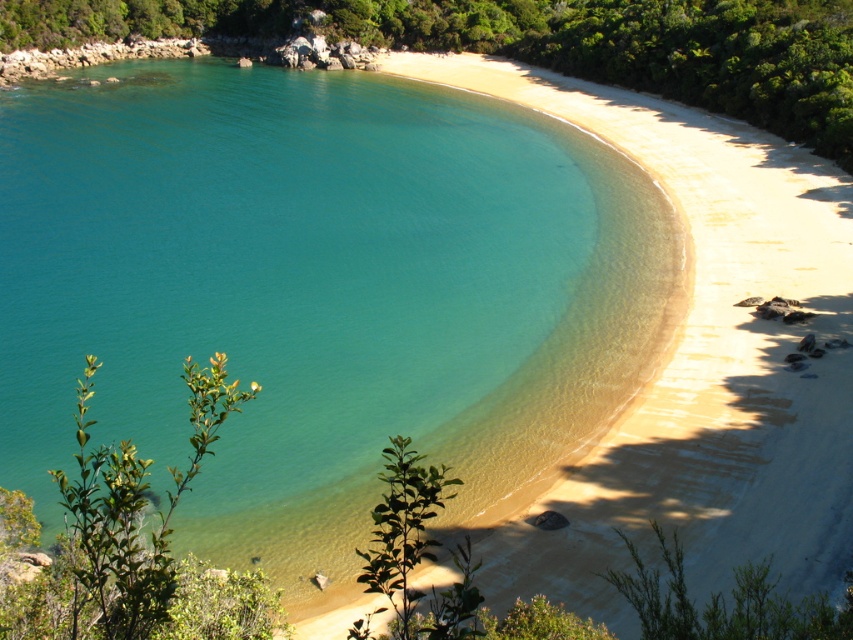
Question: Does green leafy shrub at upper left appear on the left side of green leafy shrub at lower left?

Choices:
 (A) yes
 (B) no

Answer: (B)

Question: Can you confirm if green leafy shrub at upper left is positioned to the left of green leafy shrub at lower left?

Choices:
 (A) no
 (B) yes

Answer: (A)

Question: Does green leafy shrub at upper left appear over green leafy shrub at lower left?

Choices:
 (A) yes
 (B) no

Answer: (A)